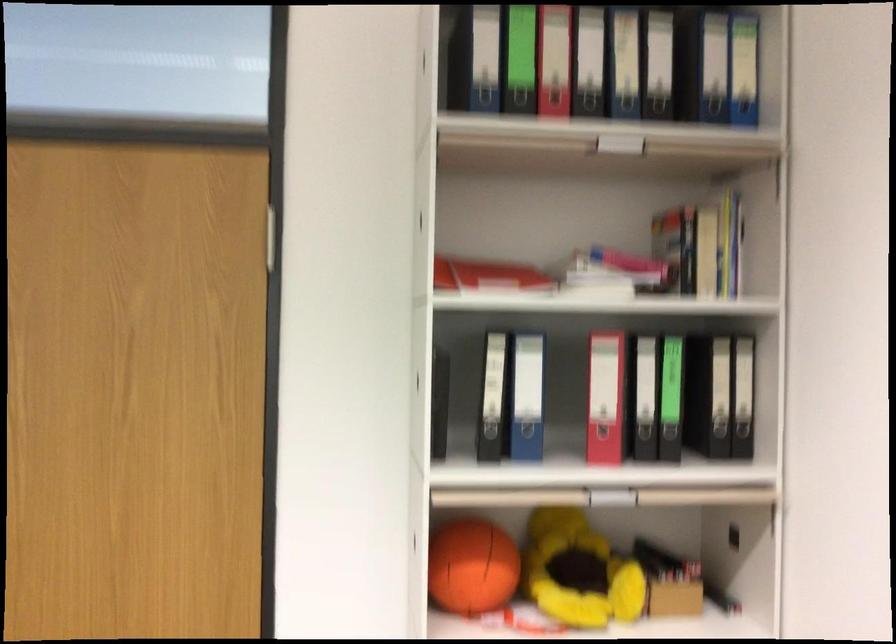
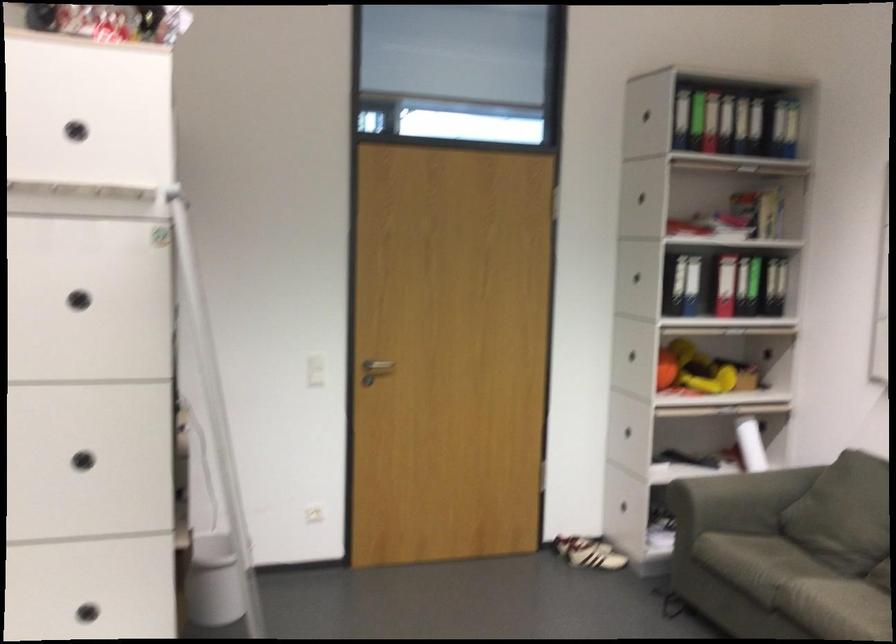
The images are taken continuously from a first-person perspective. In which direction are you moving?

The movement direction of the cameraman is left, backward.